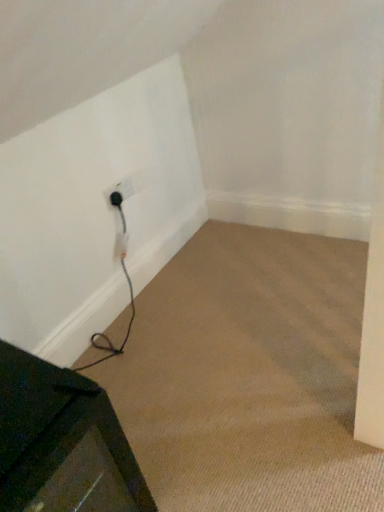
Question: In terms of height, does black plastic outlet at lower left look taller or shorter compared to black rubber plug at lower left?

Choices:
 (A) short
 (B) tall

Answer: (B)

Question: Based on their positions, is black plastic outlet at lower left located to the left or right of black rubber plug at lower left?

Choices:
 (A) left
 (B) right

Answer: (A)

Question: Which object is positioned farthest from the black plastic outlet at lower left?

Choices:
 (A) black rubber plug at lower left
 (B) metallic dark green table at lower left

Answer: (B)

Question: Estimate the real-world distances between objects in this image. Which object is farther from the black plastic outlet at lower left?

Choices:
 (A) black rubber plug at lower left
 (B) metallic dark green table at lower left

Answer: (B)